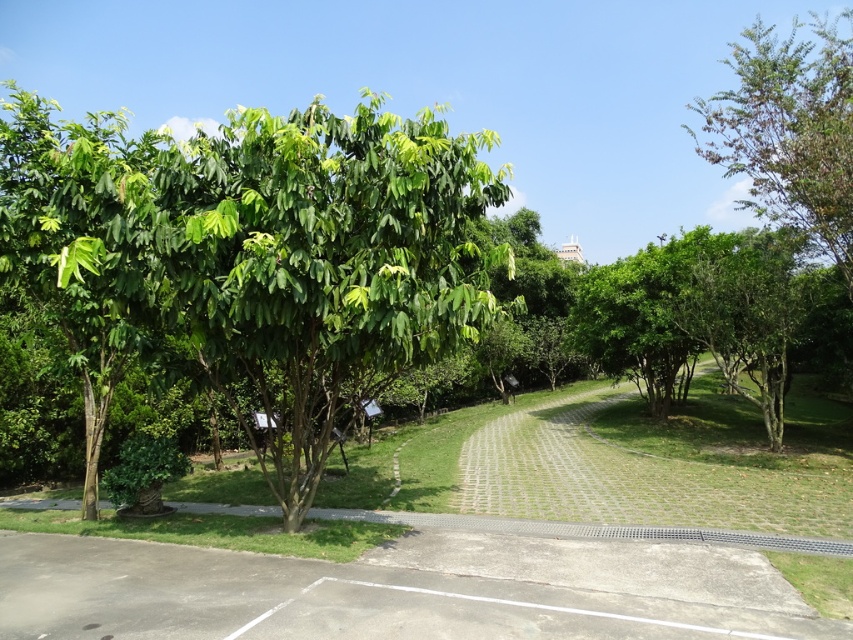
Based on the photo, who is shorter, green leafy tree at center or gray concrete path at lower center?

Standing shorter between the two is gray concrete path at lower center.

This screenshot has width=853, height=640. Identify the location of green leafy tree at center. (263, 252).

Is gray concrete path at lower center below green leafy tree at upper right?

Yes, gray concrete path at lower center is below green leafy tree at upper right.

Between point (140, 582) and point (730, 172), which one is positioned in front?

Positioned in front is point (140, 582).

Image resolution: width=853 pixels, height=640 pixels. I want to click on gray concrete path at lower center, so click(326, 600).

Who is shorter, green leafy tree at center or green leafy tree at upper right?

Standing shorter between the two is green leafy tree at center.

Is green leafy tree at center to the left of green leafy tree at upper right from the viewer's perspective?

Correct, you'll find green leafy tree at center to the left of green leafy tree at upper right.

Describe the element at coordinates (263, 252) in the screenshot. The image size is (853, 640). I see `green leafy tree at center` at that location.

The height and width of the screenshot is (640, 853). I want to click on green leafy tree at center, so click(x=263, y=252).